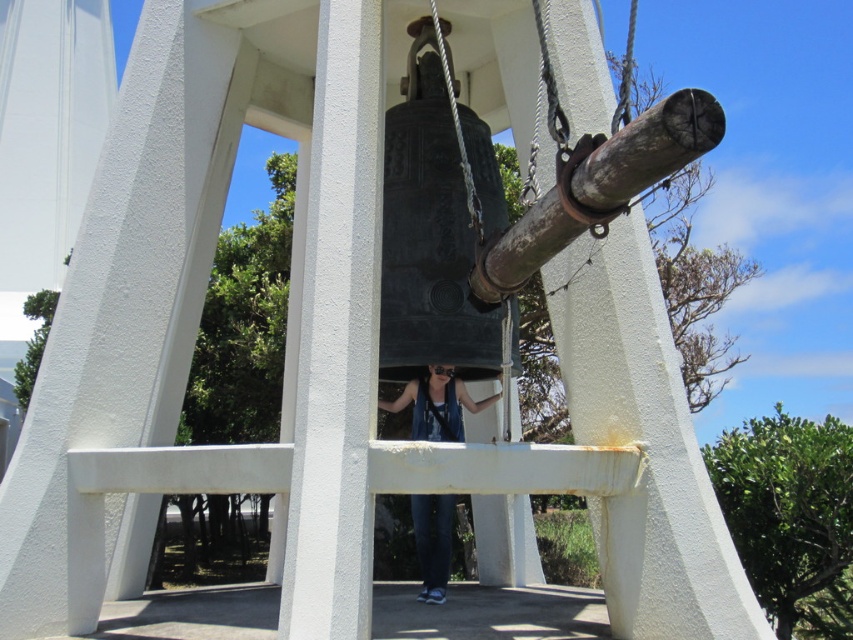
Does white smooth pillar at center have a larger size compared to blue denim jeans at center?

Yes, white smooth pillar at center is bigger than blue denim jeans at center.

Which is behind, point (329, 355) or point (421, 589)?

Positioned behind is point (421, 589).

This screenshot has width=853, height=640. Describe the element at coordinates (337, 337) in the screenshot. I see `white smooth pillar at center` at that location.

Find the location of a particular element. white smooth pillar at center is located at coordinates (337, 337).

Can you confirm if rusty metal cannon at center is bigger than blue denim jeans at center?

Yes, rusty metal cannon at center is bigger than blue denim jeans at center.

Consider the image. Does rusty metal cannon at center appear on the right side of blue denim jeans at center?

Correct, you'll find rusty metal cannon at center to the right of blue denim jeans at center.

Measure the distance between point (682, 129) and camera.

A distance of 2.72 meters exists between point (682, 129) and camera.

This screenshot has width=853, height=640. In order to click on rusty metal cannon at center in this screenshot , I will do `click(648, 148)`.

Can you confirm if white smooth pillar at center is thinner than rusty metal cannon at center?

Correct, white smooth pillar at center's width is less than rusty metal cannon at center's.

Is point (299, 550) behind point (605, 196)?

Yes, it is.

Locate an element on the screen. white smooth pillar at center is located at coordinates (337, 337).